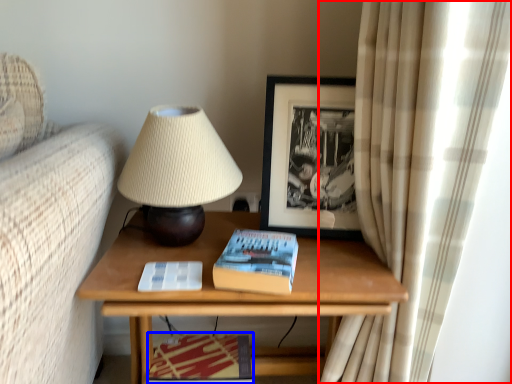
Question: Which point is closer to the camera, curtain (highlighted by a red box) or magazine (highlighted by a blue box)?

Choices:
 (A) curtain
 (B) magazine

Answer: (A)